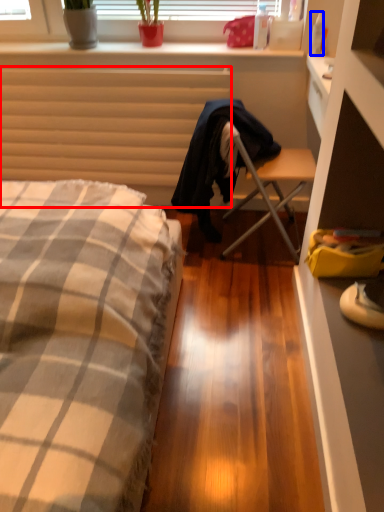
Question: Among these objects, which one is farthest to the camera, radiator (highlighted by a red box) or bottle (highlighted by a blue box)?

Choices:
 (A) radiator
 (B) bottle

Answer: (A)